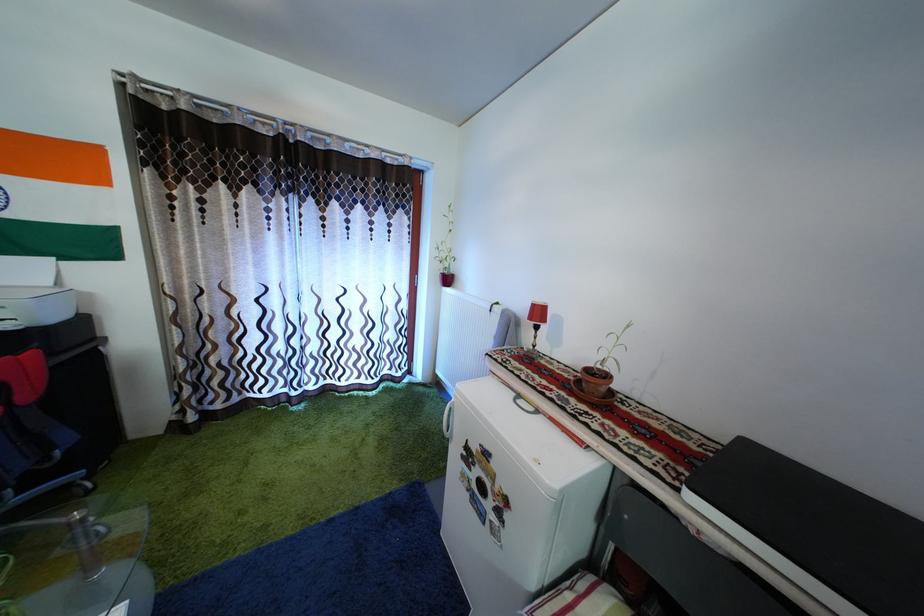
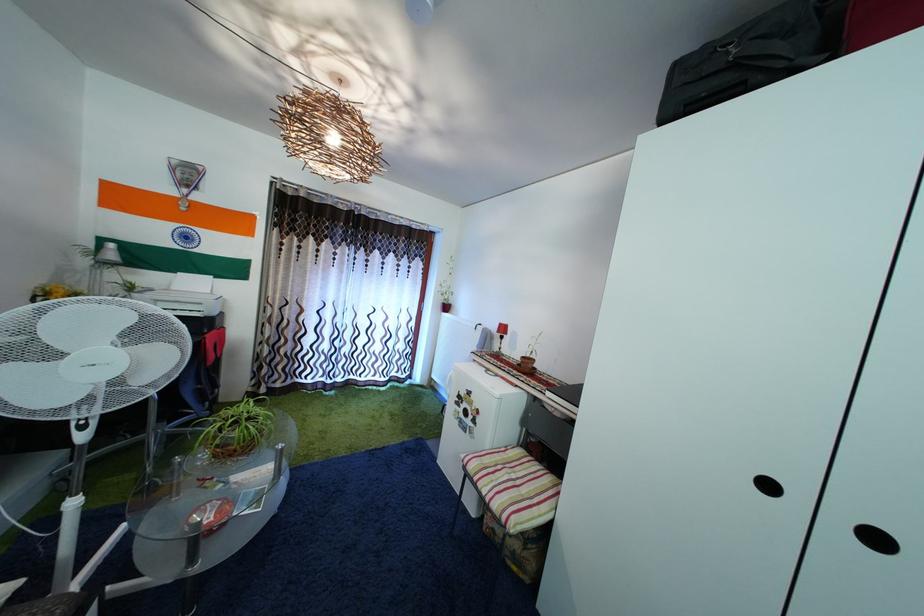
Question: What movement of the cameraman would produce the second image?

Choices:
 (A) Left
 (B) Right
 (C) Forward
 (D) Backward

Answer: (D)